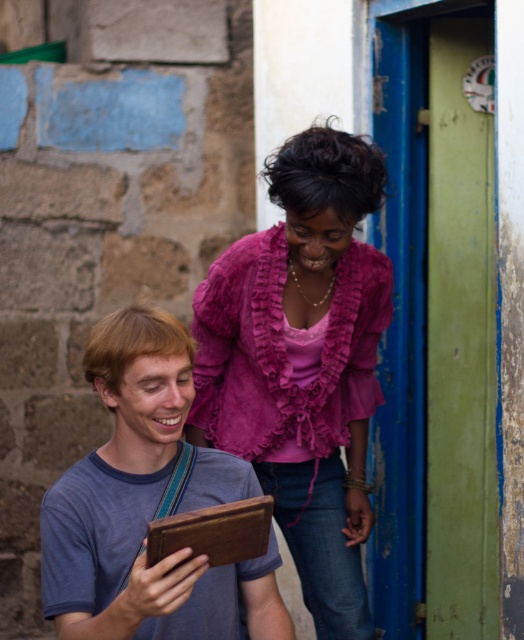
Question: Among these objects, which one is nearest to the camera?

Choices:
 (A) pink ruffled blouse at center
 (B) matte brown tablet at lower left

Answer: (B)

Question: Is pink ruffled blouse at center bigger than matte brown tablet at lower left?

Choices:
 (A) yes
 (B) no

Answer: (A)

Question: Observing the image, what is the correct spatial positioning of pink ruffled blouse at center in reference to matte brown tablet at lower left?

Choices:
 (A) below
 (B) above

Answer: (B)

Question: Can you confirm if pink ruffled blouse at center is thinner than matte brown tablet at lower left?

Choices:
 (A) yes
 (B) no

Answer: (B)

Question: Among these points, which one is nearest to the camera?

Choices:
 (A) 276,180
 (B) 73,522

Answer: (B)